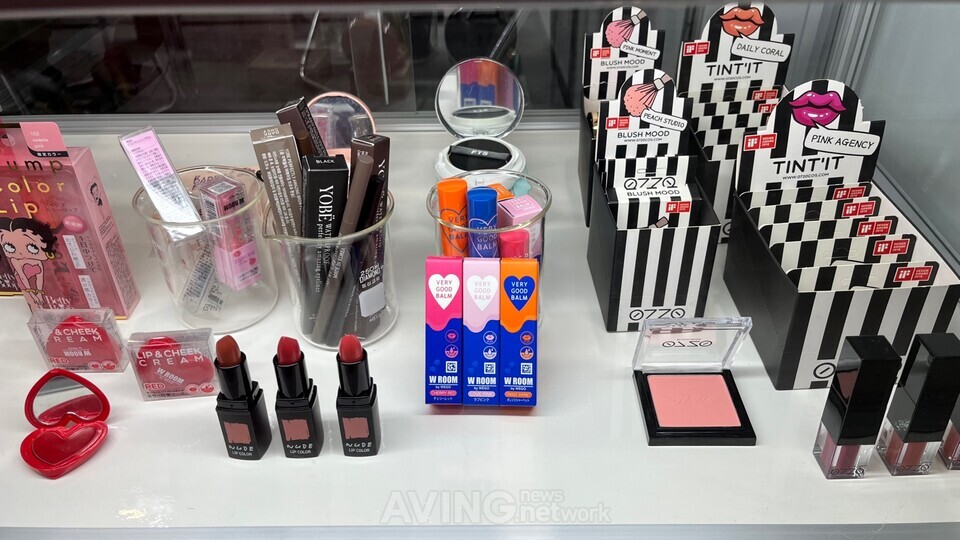
Image resolution: width=960 pixels, height=540 pixels. In order to click on mirrors in this screenshot , I will do `click(339, 114)`, `click(481, 80)`, `click(60, 394)`.